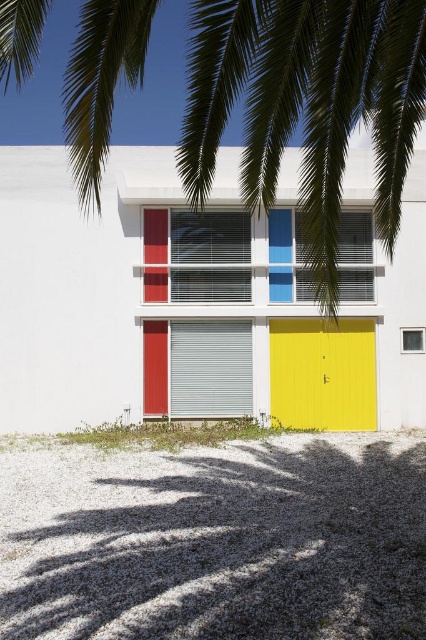
Who is shorter, green leafy palm tree at upper center or blue matte shutter at center?

blue matte shutter at center is shorter.

Is green leafy palm tree at upper center in front of blue matte shutter at center?

That is True.

Between point (333, 92) and point (276, 259), which one is positioned in front?

Point (333, 92)

At what (x,y) coordinates should I click in order to perform the action: click on green leafy palm tree at upper center. Please return your answer as a coordinate pair (x, y). The width and height of the screenshot is (426, 640). Looking at the image, I should click on (307, 104).

Who is higher up, green leafy palm tree at upper center or white plastic shutter at center?

green leafy palm tree at upper center is above.

Which of these two, green leafy palm tree at upper center or white plastic shutter at center, stands shorter?

Standing shorter between the two is white plastic shutter at center.

Is point (195, 60) farther from viewer compared to point (296, 253)?

No, it is in front of (296, 253).

Locate an element on the screen. green leafy palm tree at upper center is located at coordinates (307, 104).

Which of these two, green leafy palm tree at upper center or yellow corrugated metal door at center, stands shorter?

Standing shorter between the two is yellow corrugated metal door at center.

Can you confirm if green leafy palm tree at upper center is shorter than yellow corrugated metal door at center?

Incorrect, green leafy palm tree at upper center's height does not fall short of yellow corrugated metal door at center's.

Who is more distant from viewer, (385, 92) or (371, 349)?

Point (371, 349)

This screenshot has width=426, height=640. Find the location of `green leafy palm tree at upper center`. green leafy palm tree at upper center is located at coordinates (307, 104).